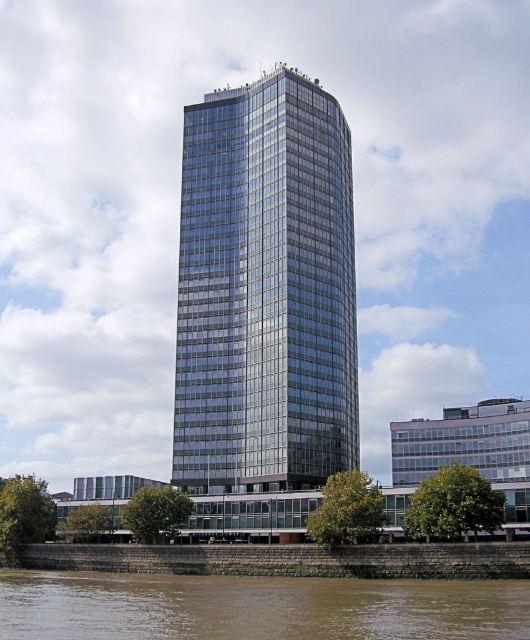
Question: Does brown sedimentary rock at lower center have a lesser width compared to brown stone wall at lower left?

Choices:
 (A) no
 (B) yes

Answer: (A)

Question: Is brown sedimentary rock at lower center to the left of brown stone wall at lower left from the viewer's perspective?

Choices:
 (A) no
 (B) yes

Answer: (B)

Question: Among these objects, which one is farthest from the camera?

Choices:
 (A) brown sedimentary rock at lower center
 (B) glassy metallic tower at center

Answer: (B)

Question: Observing the image, what is the correct spatial positioning of brown sedimentary rock at lower center in reference to brown stone wall at lower left?

Choices:
 (A) right
 (B) left

Answer: (B)

Question: Among these points, which one is farthest from the camera?

Choices:
 (A) [x=434, y=576]
 (B) [x=6, y=584]

Answer: (B)

Question: Which object is closer to the camera taking this photo?

Choices:
 (A) brown stone wall at lower left
 (B) glassy metallic tower at center
 (C) brown sedimentary rock at lower center

Answer: (C)